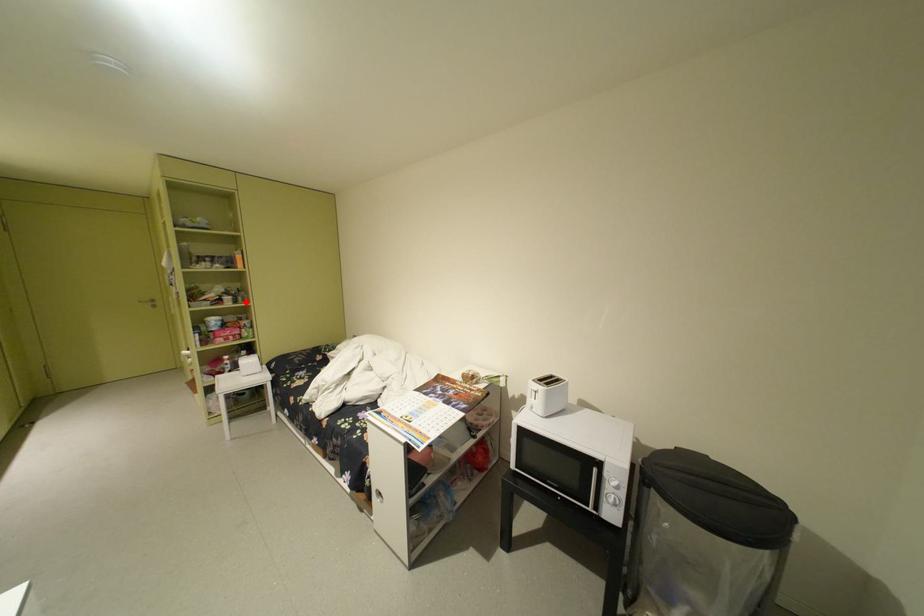
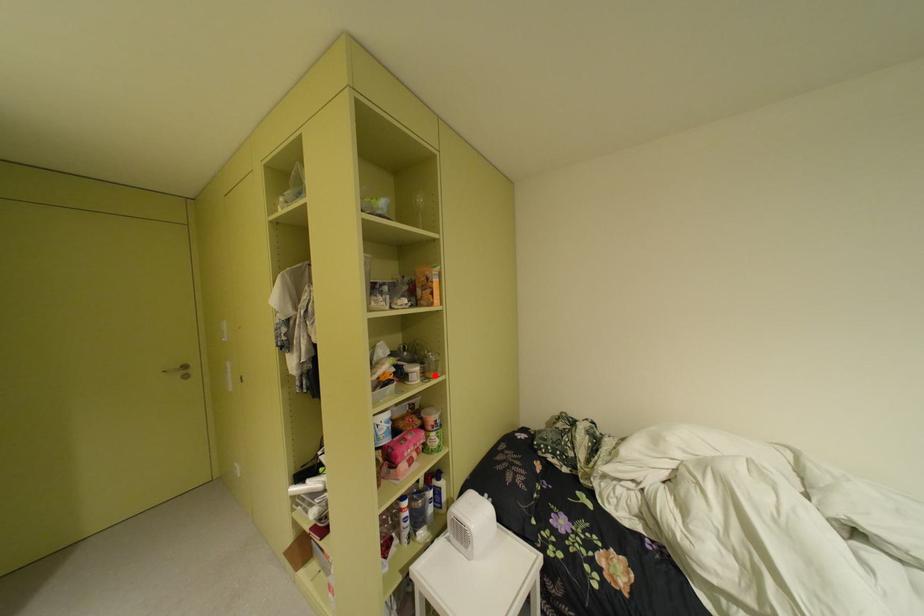
I am providing you with two images of the same scene from different viewpoints. A red point is marked on the first image and another point is marked on the second image. Are the points marked in image1 and image2 representing the same 3D position?

Yes